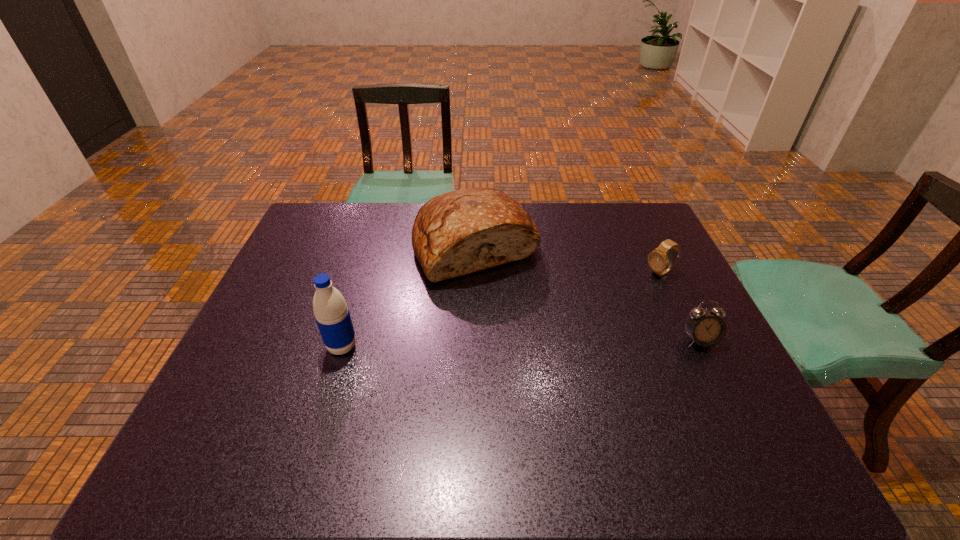
Find the location of a particular element. vacant region at the near right corner of the desktop is located at coordinates (757, 416).

Image resolution: width=960 pixels, height=540 pixels. In order to click on vacant space in between the alarm clock and the leftmost object in this screenshot , I will do `click(520, 343)`.

The image size is (960, 540). Find the location of `free area in between the third object from right to left and the alarm clock`. free area in between the third object from right to left and the alarm clock is located at coordinates coord(588,293).

This screenshot has width=960, height=540. Identify the location of empty space between the bread and the alarm clock. (588, 293).

Identify the location of vacant space that's between the water bottle and the third object from right to left. This screenshot has height=540, width=960. (409, 296).

Where is `vacant area that lies between the leftmost object and the watch`? vacant area that lies between the leftmost object and the watch is located at coordinates (501, 310).

Locate an element on the screen. free space between the watch and the third shortest object is located at coordinates (567, 260).

Where is `free spot between the third shortest object and the water bottle`? This screenshot has height=540, width=960. free spot between the third shortest object and the water bottle is located at coordinates (409, 296).

Where is `unoccupied area between the third shortest object and the alarm clock`? This screenshot has height=540, width=960. unoccupied area between the third shortest object and the alarm clock is located at coordinates (588, 293).

In order to click on empty location between the third object from right to left and the alarm clock in this screenshot , I will do `click(588, 293)`.